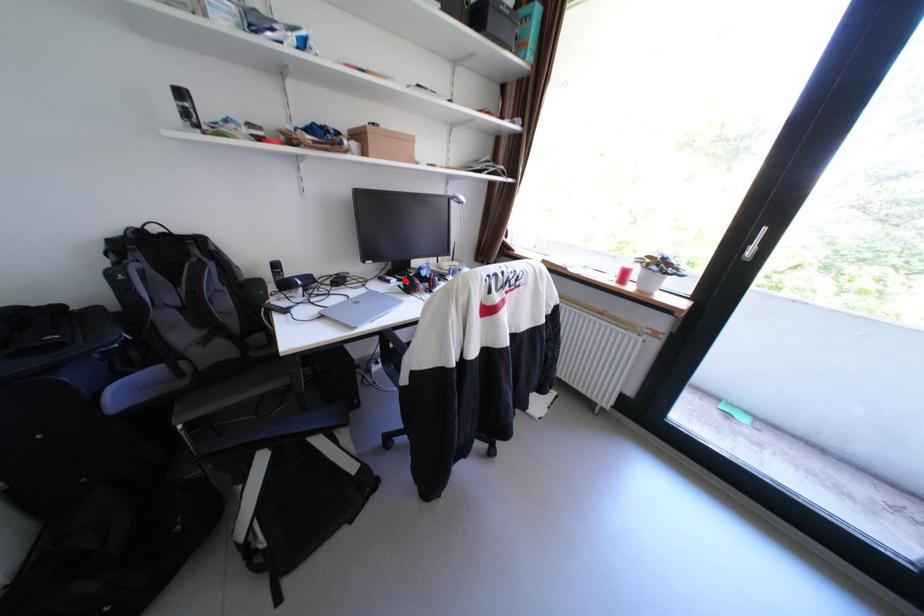
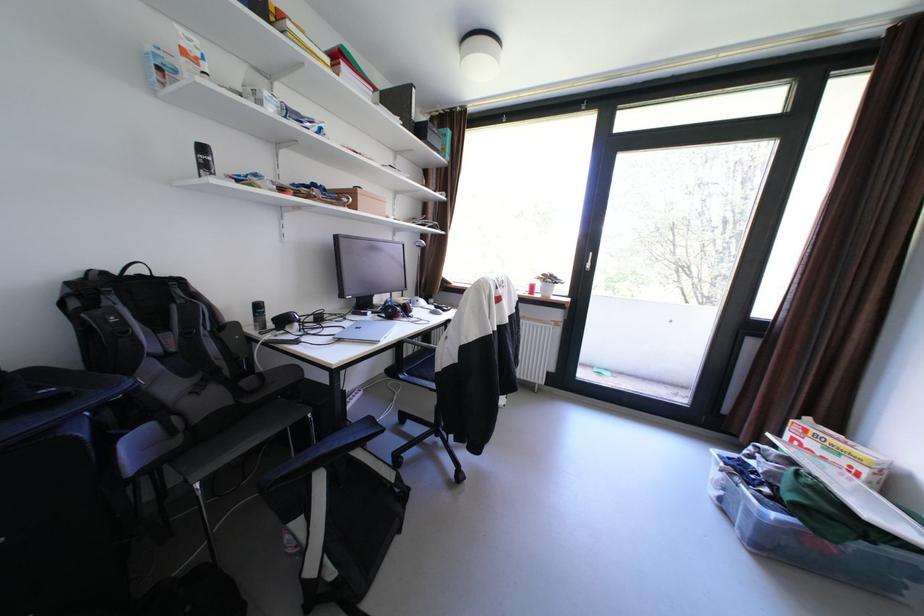
Where in the second image is the point corresponding to the highlighted location from the first image?

(380, 313)